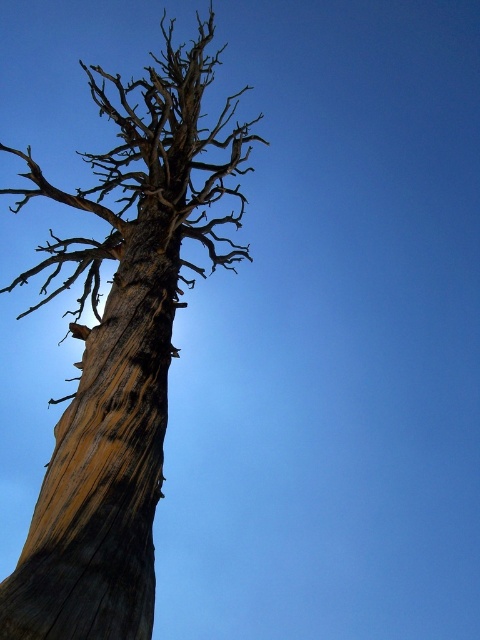
The height and width of the screenshot is (640, 480). What do you see at coordinates (121, 348) in the screenshot?
I see `weathered wood tree trunk at center` at bounding box center [121, 348].

In the scene shown: Can you confirm if weathered wood tree trunk at center is shorter than weathered wood tree trunk at left?

No, weathered wood tree trunk at center is not shorter than weathered wood tree trunk at left.

The height and width of the screenshot is (640, 480). I want to click on weathered wood tree trunk at center, so click(121, 348).